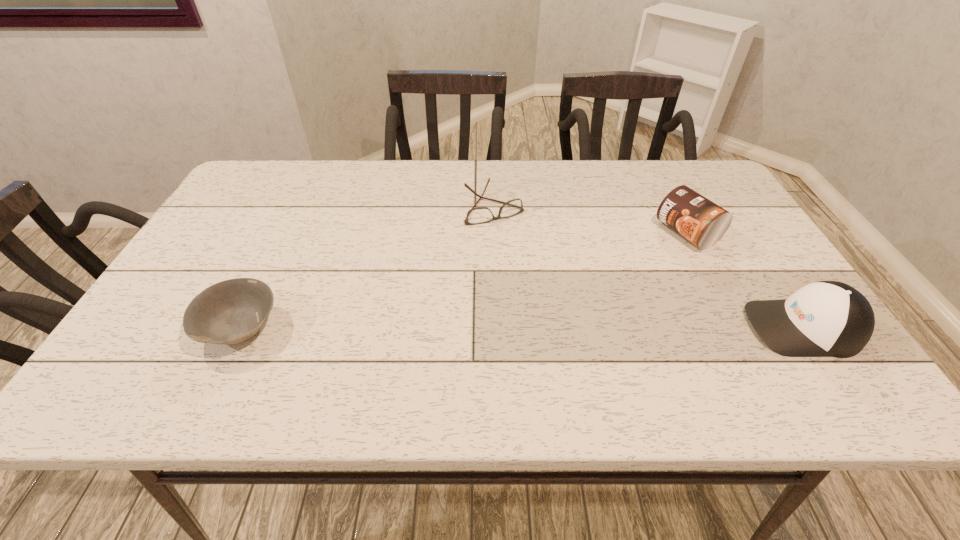
At what (x,y) coordinates should I click in order to perform the action: click on free spot on the desktop that is between the leftmost object and the cap and is positioned on the front-facing side of the shortest object. Please return your answer as a coordinate pair (x, y). The height and width of the screenshot is (540, 960). Looking at the image, I should click on (573, 327).

Where is `free space on the desktop that is between the leftmost object and the cap and is positioned on the front label of the can`? free space on the desktop that is between the leftmost object and the cap and is positioned on the front label of the can is located at coordinates (485, 327).